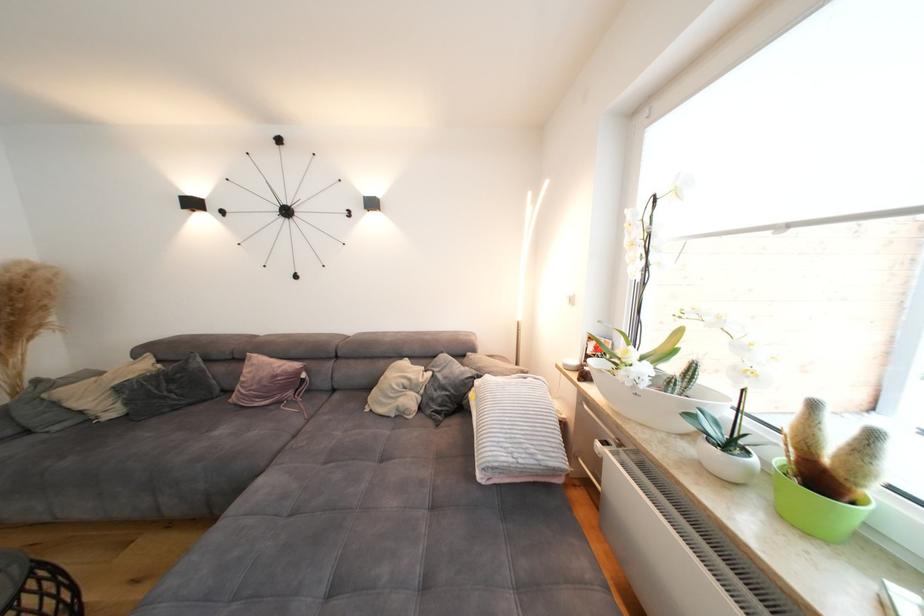
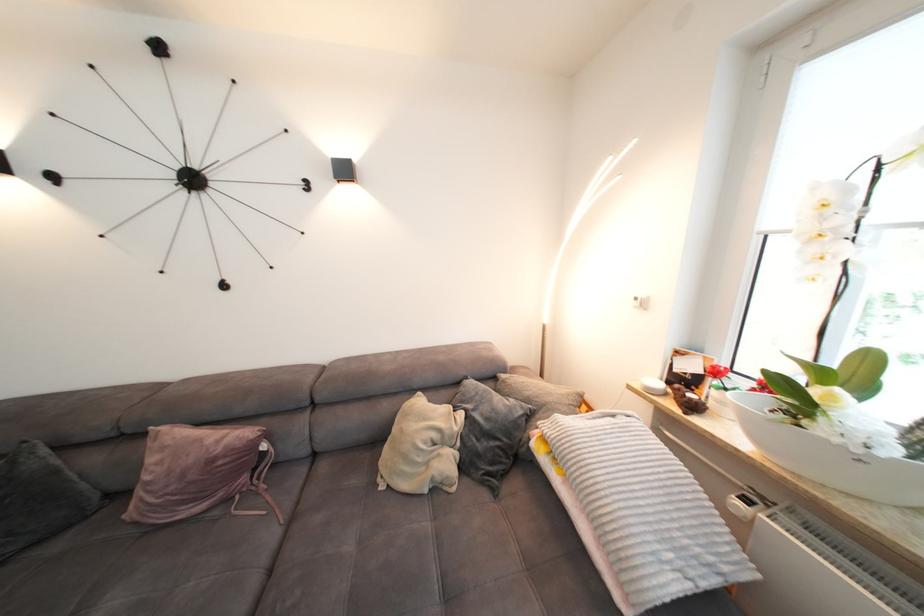
The point at (418, 387) is marked in the first image. Where is the corresponding point in the second image?

(450, 440)